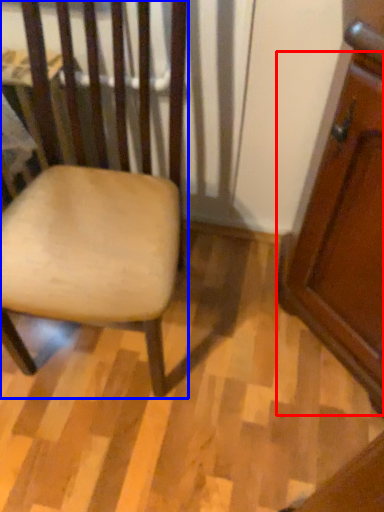
Question: Among these objects, which one is nearest to the camera, screen door (highlighted by a red box) or chair (highlighted by a blue box)?

Choices:
 (A) screen door
 (B) chair

Answer: (B)